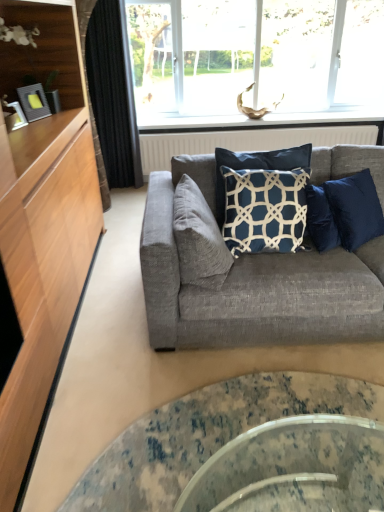
Question: Is white textured radiator at upper center positioned beyond the bounds of textured gray couch at center?

Choices:
 (A) no
 (B) yes

Answer: (B)

Question: From a real-world perspective, is white textured radiator at upper center positioned under textured gray couch at center based on gravity?

Choices:
 (A) no
 (B) yes

Answer: (B)

Question: Is white textured radiator at upper center thinner than textured gray couch at center?

Choices:
 (A) yes
 (B) no

Answer: (A)

Question: Is white textured radiator at upper center positioned far away from textured gray couch at center?

Choices:
 (A) yes
 (B) no

Answer: (A)

Question: Is white textured radiator at upper center oriented away from textured gray couch at center?

Choices:
 (A) no
 (B) yes

Answer: (A)

Question: Considering the positions of suede gray pillow at center, the 1th pillow in the left-to-right sequence, and navy blue fabric pillow at center, marked as the first pillow in a right-to-left arrangement, in the image, is suede gray pillow at center, the 1th pillow in the left-to-right sequence, wider or thinner than navy blue fabric pillow at center, marked as the first pillow in a right-to-left arrangement,?

Choices:
 (A) wide
 (B) thin

Answer: (B)

Question: In the image, is suede gray pillow at center, the 1th pillow in the left-to-right sequence, positioned in front of or behind navy blue fabric pillow at center, marked as the first pillow in a right-to-left arrangement?

Choices:
 (A) front
 (B) behind

Answer: (A)

Question: Visually, is suede gray pillow at center, the 1th pillow in the left-to-right sequence, positioned to the left or to the right of navy blue fabric pillow at center, marked as the first pillow in a right-to-left arrangement?

Choices:
 (A) right
 (B) left

Answer: (B)

Question: From the image's perspective, relative to navy blue fabric pillow at center, which appears as the second pillow when viewed from the left, is suede gray pillow at center, placed as the second pillow when sorted from right to left, above or below?

Choices:
 (A) above
 (B) below

Answer: (B)

Question: From their relative heights in the image, would you say white textured radiator at upper center is taller or shorter than textured gray couch at center?

Choices:
 (A) tall
 (B) short

Answer: (B)

Question: Is point coord(317,135) closer or farther from the camera than point coord(192,332)?

Choices:
 (A) closer
 (B) farther

Answer: (B)

Question: From the image's perspective, is white textured radiator at upper center located above or below textured gray couch at center?

Choices:
 (A) below
 (B) above

Answer: (B)

Question: Considering their positions, is white textured radiator at upper center located in front of or behind textured gray couch at center?

Choices:
 (A) front
 (B) behind

Answer: (B)

Question: In terms of width, does white textured radiator at upper center look wider or thinner when compared to suede gray pillow at center, placed as the second pillow when sorted from right to left?

Choices:
 (A) thin
 (B) wide

Answer: (A)

Question: Considering the positions of point (317, 138) and point (188, 252), is point (317, 138) closer or farther from the camera than point (188, 252)?

Choices:
 (A) farther
 (B) closer

Answer: (A)